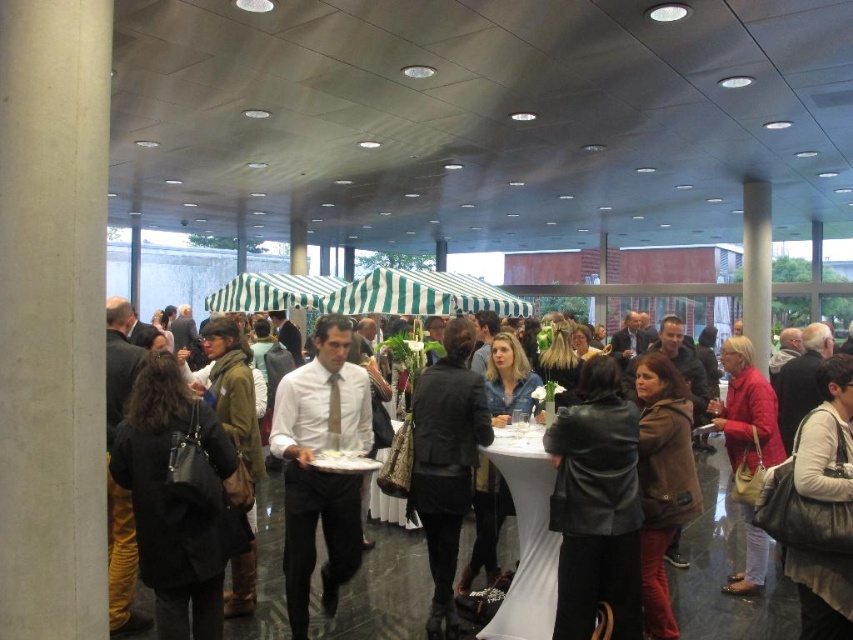
You are a guest at this event and want to sit down. You see the white shirt at center and the white fabric table at center. Which one is wider?

The white shirt at center is wider than the white fabric table at center.

You are a guest at the event and want to reach the white fabric table at center without walking through the crowd. Can you go around the white shirt at center to the right side?

The white shirt at center is to the left of the white fabric table at center, so you can go around to the right side of the white shirt at center to reach the table without walking through the crowd.